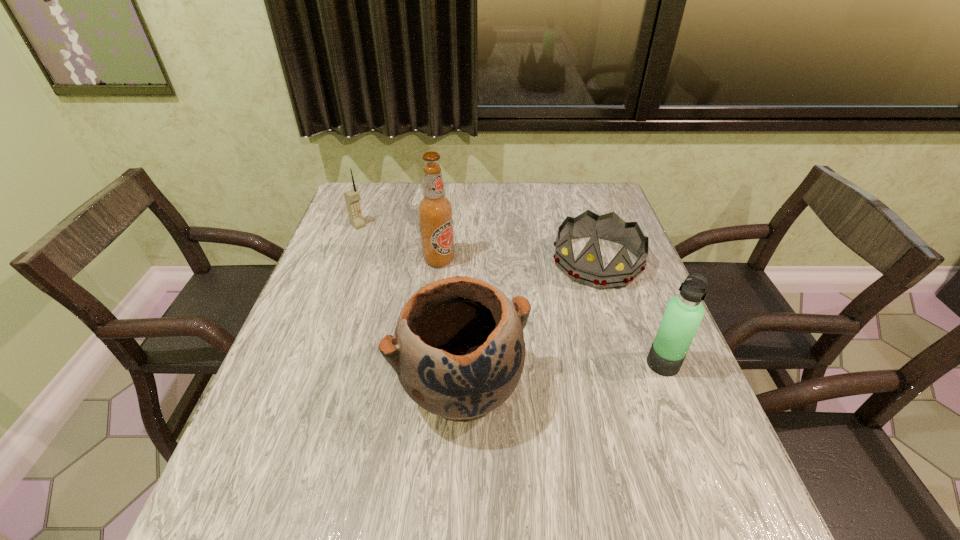
Where is `vacant space situated 0.180m on the front label of the beer bottle`? The width and height of the screenshot is (960, 540). vacant space situated 0.180m on the front label of the beer bottle is located at coordinates (486, 306).

You are a GUI agent. You are given a task and a screenshot of the screen. Output one action in this format:
    pyautogui.click(x=<x>, y=<y>)
    Task: Click on the vacant region located on the front of the leftmost object, where the keypad is located
    This screenshot has height=540, width=960.
    Given the screenshot: What is the action you would take?
    pyautogui.click(x=421, y=279)

This screenshot has width=960, height=540. In order to click on vacant region located on the front of the leftmost object, where the keypad is located in this screenshot , I will do pos(393,255).

At what (x,y) coordinates should I click in order to perform the action: click on vacant space located 0.330m on the front of the leftmost object, where the keypad is located. Please return your answer as a coordinate pair (x, y). This screenshot has height=540, width=960. Looking at the image, I should click on (426, 283).

This screenshot has height=540, width=960. What are the coordinates of `free space located 0.400m at the front of the tiara with jewels` in the screenshot? It's located at (526, 410).

This screenshot has height=540, width=960. In order to click on vacant space located 0.160m at the front of the tiara with jewels in this screenshot , I will do `click(564, 329)`.

At what (x,y) coordinates should I click in order to perform the action: click on free space located 0.230m at the front of the tiara with jewels. Please return your answer as a coordinate pair (x, y). This screenshot has width=960, height=540. Looking at the image, I should click on (554, 350).

I want to click on object located at the far edge, so click(x=352, y=197).

What are the coordinates of `object positioned at the near edge` in the screenshot? It's located at (458, 350).

Where is `object at the left edge`? object at the left edge is located at coordinates (352, 197).